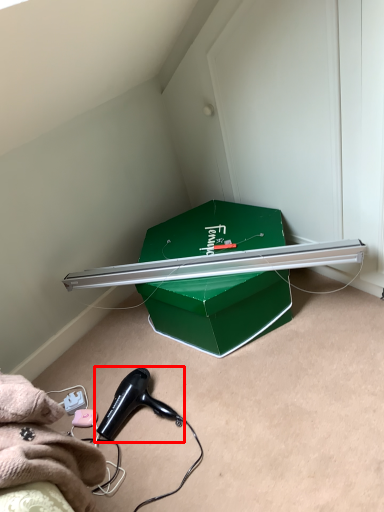
Question: From the image's perspective, where is hair drier (annotated by the red box) located in relation to box in the image?

Choices:
 (A) below
 (B) above

Answer: (A)